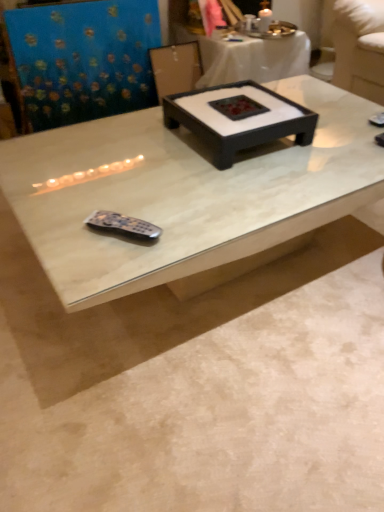
At what (x,y) coordinates should I click in order to perform the action: click on vacant space situated above white marble coffee table at center, which appears as the first coffee table when viewed from the left (from a real-world perspective). Please return your answer as a coordinate pair (x, y). The image size is (384, 512). Looking at the image, I should click on (211, 161).